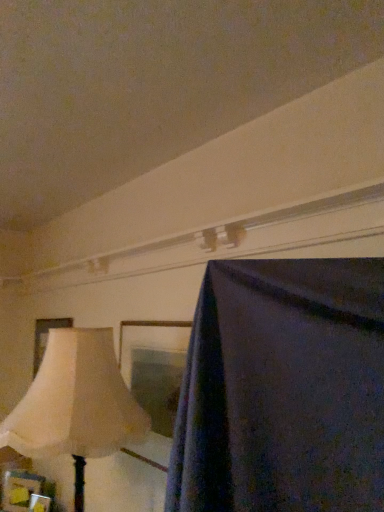
I want to click on matte cream picture frame at left, the first picture frame when ordered from back to front, so click(x=46, y=337).

This screenshot has width=384, height=512. In order to click on wooden picture frame at lower left, marked as the second picture frame in a bottom-to-top arrangement in this screenshot , I will do `click(40, 503)`.

Where is `wooden picture frame at lower left, the first picture frame when ordered from bottom to top`? wooden picture frame at lower left, the first picture frame when ordered from bottom to top is located at coordinates (20, 489).

This screenshot has width=384, height=512. I want to click on matte cream picture frame at left, the first picture frame when ordered from back to front, so pyautogui.click(x=46, y=337).

In terms of height, does beige fabric lampshade at left look taller or shorter compared to wooden picture frame at lower left, placed as the second picture frame when sorted from front to back?

Considering their sizes, beige fabric lampshade at left has more height than wooden picture frame at lower left, placed as the second picture frame when sorted from front to back.

Are beige fabric lampshade at left and wooden picture frame at lower left, marked as the third picture frame in a top-to-bottom arrangement, far apart?

Yes, beige fabric lampshade at left and wooden picture frame at lower left, marked as the third picture frame in a top-to-bottom arrangement, are located far from each other.

This screenshot has height=512, width=384. What are the coordinates of `lamp lying in front of the wooden picture frame at lower left, the first picture frame when ordered from bottom to top` in the screenshot? It's located at (76, 404).

Locate an element on the screen. the 1st picture frame above the wooden picture frame at lower left, acting as the 1th picture frame starting from the front (from a real-world perspective) is located at coordinates (20, 489).

Could you tell me if wooden picture frame at lower left, marked as the second picture frame in a bottom-to-top arrangement, is facing wooden picture frame at lower left, the 2th picture frame from the back?

No, wooden picture frame at lower left, marked as the second picture frame in a bottom-to-top arrangement, is not facing towards wooden picture frame at lower left, the 2th picture frame from the back.

From a real-world perspective, is wooden picture frame at lower left, acting as the 1th picture frame starting from the front, physically above wooden picture frame at lower left, marked as the third picture frame in a top-to-bottom arrangement?

Actually, wooden picture frame at lower left, acting as the 1th picture frame starting from the front, is physically below wooden picture frame at lower left, marked as the third picture frame in a top-to-bottom arrangement, in the real world.

From a real-world perspective, is wooden picture frame at lower left, placed as the second picture frame when sorted from front to back, positioned under matte cream picture frame at left, the 1th picture frame in the top-to-bottom sequence, based on gravity?

Yes, from a real-world perspective, wooden picture frame at lower left, placed as the second picture frame when sorted from front to back, is under matte cream picture frame at left, the 1th picture frame in the top-to-bottom sequence.

Is wooden picture frame at lower left, the 2th picture frame from the back, inside the boundaries of matte cream picture frame at left, which is the third picture frame from front to back, or outside?

wooden picture frame at lower left, the 2th picture frame from the back, is not inside matte cream picture frame at left, which is the third picture frame from front to back, it's outside.

In the scene shown: Can you tell me how much wooden picture frame at lower left, placed as the second picture frame when sorted from front to back, and matte cream picture frame at left, which is the third picture frame from front to back, differ in facing direction?

The facing directions of wooden picture frame at lower left, placed as the second picture frame when sorted from front to back, and matte cream picture frame at left, which is the third picture frame from front to back, are 29.5 degrees apart.

Considering the relative sizes of wooden picture frame at lower left, the 2th picture frame from the back, and matte cream picture frame at left, the 1th picture frame in the top-to-bottom sequence, in the image provided, is wooden picture frame at lower left, the 2th picture frame from the back, wider than matte cream picture frame at left, the 1th picture frame in the top-to-bottom sequence,?

Indeed, wooden picture frame at lower left, the 2th picture frame from the back, has a greater width compared to matte cream picture frame at left, the 1th picture frame in the top-to-bottom sequence.

You are a GUI agent. You are given a task and a screenshot of the screen. Output one action in this format:
    pyautogui.click(x=<x>, y=<y>)
    Task: Click on the lamp below the matte cream picture frame at left, the third picture frame when ordered from bottom to top (from the image's perspective)
    This screenshot has height=512, width=384.
    Given the screenshot: What is the action you would take?
    pyautogui.click(x=76, y=404)

Is beige fabric lampshade at left further to camera compared to matte cream picture frame at left, which is the third picture frame from front to back?

No, beige fabric lampshade at left is in front of matte cream picture frame at left, which is the third picture frame from front to back.

Does beige fabric lampshade at left have a lesser height compared to matte cream picture frame at left, the 1th picture frame in the top-to-bottom sequence?

No, beige fabric lampshade at left is not shorter than matte cream picture frame at left, the 1th picture frame in the top-to-bottom sequence.

Is beige fabric lampshade at left not inside matte cream picture frame at left, which is the third picture frame from front to back?

That's correct, beige fabric lampshade at left is outside of matte cream picture frame at left, which is the third picture frame from front to back.

Who is shorter, wooden picture frame at lower left, which appears as the third picture frame when viewed from the back, or beige fabric lampshade at left?

wooden picture frame at lower left, which appears as the third picture frame when viewed from the back.

The height and width of the screenshot is (512, 384). Identify the location of the 1st picture frame below when counting from the beige fabric lampshade at left (from the image's perspective). point(40,503).

From the image's perspective, between wooden picture frame at lower left, acting as the 1th picture frame starting from the front, and beige fabric lampshade at left, who is located below?

wooden picture frame at lower left, acting as the 1th picture frame starting from the front.

Identify the location of the 1st picture frame behind the wooden picture frame at lower left, which appears as the third picture frame when viewed from the back. (20, 489).

Looking at this image, can you confirm if wooden picture frame at lower left, the 2th picture frame from the back, is taller than wooden picture frame at lower left, marked as the second picture frame in a bottom-to-top arrangement?

Indeed, wooden picture frame at lower left, the 2th picture frame from the back, has a greater height compared to wooden picture frame at lower left, marked as the second picture frame in a bottom-to-top arrangement.

Considering the positions of objects wooden picture frame at lower left, marked as the third picture frame in a top-to-bottom arrangement, and wooden picture frame at lower left, marked as the second picture frame in a bottom-to-top arrangement, in the image provided, who is more to the right, wooden picture frame at lower left, marked as the third picture frame in a top-to-bottom arrangement, or wooden picture frame at lower left, marked as the second picture frame in a bottom-to-top arrangement,?

wooden picture frame at lower left, marked as the second picture frame in a bottom-to-top arrangement.

Considering the sizes of wooden picture frame at lower left, the first picture frame when ordered from bottom to top, and wooden picture frame at lower left, which appears as the third picture frame when viewed from the back, in the image, is wooden picture frame at lower left, the first picture frame when ordered from bottom to top, wider or thinner than wooden picture frame at lower left, which appears as the third picture frame when viewed from the back,?

Considering their sizes, wooden picture frame at lower left, the first picture frame when ordered from bottom to top, looks slimmer than wooden picture frame at lower left, which appears as the third picture frame when viewed from the back.

Are beige fabric lampshade at left and wooden picture frame at lower left, marked as the second picture frame in a bottom-to-top arrangement, making contact?

No, beige fabric lampshade at left is not making contact with wooden picture frame at lower left, marked as the second picture frame in a bottom-to-top arrangement.

From a real-world perspective, is beige fabric lampshade at left above or below wooden picture frame at lower left, acting as the 1th picture frame starting from the front?

beige fabric lampshade at left is above wooden picture frame at lower left, acting as the 1th picture frame starting from the front.

Does point (92, 355) lie behind point (50, 499)?

No, (92, 355) is closer to viewer.

You are a GUI agent. You are given a task and a screenshot of the screen. Output one action in this format:
    pyautogui.click(x=<x>, y=<y>)
    Task: Click on the 2nd picture frame behind the beige fabric lampshade at left, counting from the anchor's position
    This screenshot has height=512, width=384.
    Given the screenshot: What is the action you would take?
    pyautogui.click(x=20, y=489)

Find the location of a particular element. This screenshot has height=512, width=384. the 1st picture frame located above the wooden picture frame at lower left, which appears as the third picture frame when viewed from the back (from a real-world perspective) is located at coordinates (20, 489).

From the image, which object appears to be nearer to wooden picture frame at lower left, placed as the second picture frame when sorted from front to back, beige fabric lampshade at left or wooden picture frame at lower left, acting as the 1th picture frame starting from the front?

wooden picture frame at lower left, acting as the 1th picture frame starting from the front, is positioned closer to the anchor wooden picture frame at lower left, placed as the second picture frame when sorted from front to back.

Looking at the image, which one is located closer to matte cream picture frame at left, the first picture frame when ordered from back to front, beige fabric lampshade at left or wooden picture frame at lower left, the 2th picture frame from the back?

wooden picture frame at lower left, the 2th picture frame from the back, is positioned closer to the anchor matte cream picture frame at left, the first picture frame when ordered from back to front.

Looking at this image, when comparing their distances from wooden picture frame at lower left, placed as the second picture frame when sorted from front to back, does wooden picture frame at lower left, acting as the 1th picture frame starting from the front, or matte cream picture frame at left, which is the third picture frame from front to back, seem closer?

The object closer to wooden picture frame at lower left, placed as the second picture frame when sorted from front to back, is wooden picture frame at lower left, acting as the 1th picture frame starting from the front.

Estimate the real-world distances between objects in this image. Which object is closer to wooden picture frame at lower left, placed as the second picture frame when sorted from top to bottom, matte cream picture frame at left, which is the third picture frame from front to back, or beige fabric lampshade at left?

The object closer to wooden picture frame at lower left, placed as the second picture frame when sorted from top to bottom, is matte cream picture frame at left, which is the third picture frame from front to back.

Looking at the image, which one is located further to wooden picture frame at lower left, the 2th picture frame from the back, wooden picture frame at lower left, placed as the second picture frame when sorted from top to bottom, or beige fabric lampshade at left?

beige fabric lampshade at left is further to wooden picture frame at lower left, the 2th picture frame from the back.

Estimate the real-world distances between objects in this image. Which object is further from matte cream picture frame at left, the first picture frame when ordered from back to front, wooden picture frame at lower left, marked as the second picture frame in a bottom-to-top arrangement, or wooden picture frame at lower left, the 2th picture frame from the back?

wooden picture frame at lower left, marked as the second picture frame in a bottom-to-top arrangement, lies further to matte cream picture frame at left, the first picture frame when ordered from back to front, than the other object.

From the image, which object appears to be farther from wooden picture frame at lower left, the 2th picture frame from the back, matte cream picture frame at left, the third picture frame when ordered from bottom to top, or wooden picture frame at lower left, which appears as the third picture frame when viewed from the back?

The object further to wooden picture frame at lower left, the 2th picture frame from the back, is matte cream picture frame at left, the third picture frame when ordered from bottom to top.

When comparing their distances from wooden picture frame at lower left, acting as the 1th picture frame starting from the front, does beige fabric lampshade at left or wooden picture frame at lower left, marked as the third picture frame in a top-to-bottom arrangement, seem further?

beige fabric lampshade at left lies further to wooden picture frame at lower left, acting as the 1th picture frame starting from the front, than the other object.

The height and width of the screenshot is (512, 384). What are the coordinates of `picture frame between matte cream picture frame at left, the first picture frame when ordered from back to front, and wooden picture frame at lower left, placed as the second picture frame when sorted from front to back, in the up-down direction` in the screenshot? It's located at (40, 503).

At what (x,y) coordinates should I click in order to perform the action: click on picture frame between beige fabric lampshade at left and wooden picture frame at lower left, the first picture frame when ordered from bottom to top, in the front-back direction. Please return your answer as a coordinate pair (x, y). The height and width of the screenshot is (512, 384). Looking at the image, I should click on (40, 503).